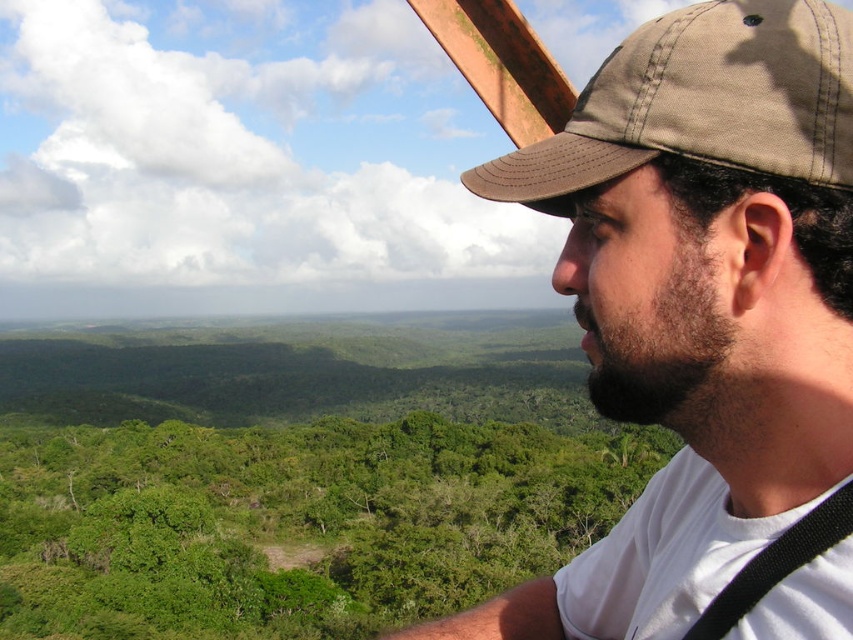
Consider the image. You are a hiker who wants to take a photo of the green leafy trees at center and the brown canvas baseball cap at upper right. Which object should you focus on first if you want to capture both in the same frame?

The green leafy trees at center is positioned on the left side of brown canvas baseball cap at upper right, so you should focus on the green leafy trees at center first to ensure both are in the same frame.

From the picture: You are standing at the edge of a cliff overlooking a forest. You see a point at coordinates (x=698, y=301). Where is this point located?

The point at coordinates (x=698, y=301) is located on the brown fabric cap at upper right.

You are a photographer trying to capture a clear shot of the green leafy trees at center. However, the brown fabric cap at upper right is blocking your view. Can you determine if the cap is taller than the trees to know whether adjusting your angle upwards might help?

The brown fabric cap at upper right has a greater height compared to green leafy trees at center. Therefore, adjusting your angle upwards might not help as the cap is taller and could still obstruct the view.